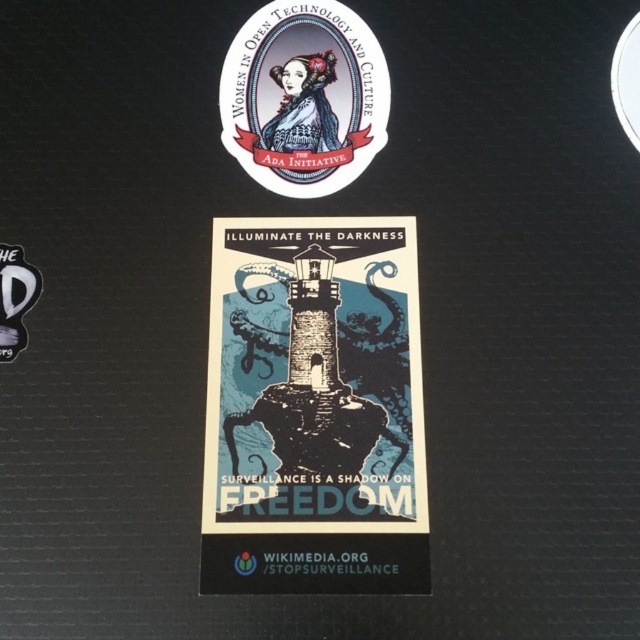
Question: Which of the following is the farthest from the observer?

Choices:
 (A) white fabric logo at lower left
 (B) matte paper sticker at upper center

Answer: (B)

Question: Which point is closer to the camera?

Choices:
 (A) (17, 294)
 (B) (298, 58)
 (C) (380, 317)

Answer: (C)

Question: Estimate the real-world distances between objects in this image. Which object is closer to the blue paper poster at center?

Choices:
 (A) matte paper sticker at upper center
 (B) white fabric logo at lower left

Answer: (A)

Question: Where is matte paper sticker at upper center located in relation to white fabric logo at lower left in the image?

Choices:
 (A) left
 (B) right

Answer: (B)

Question: Can you confirm if blue paper poster at center is bigger than white fabric logo at lower left?

Choices:
 (A) yes
 (B) no

Answer: (A)

Question: In this image, where is blue paper poster at center located relative to white fabric logo at lower left?

Choices:
 (A) below
 (B) above

Answer: (A)